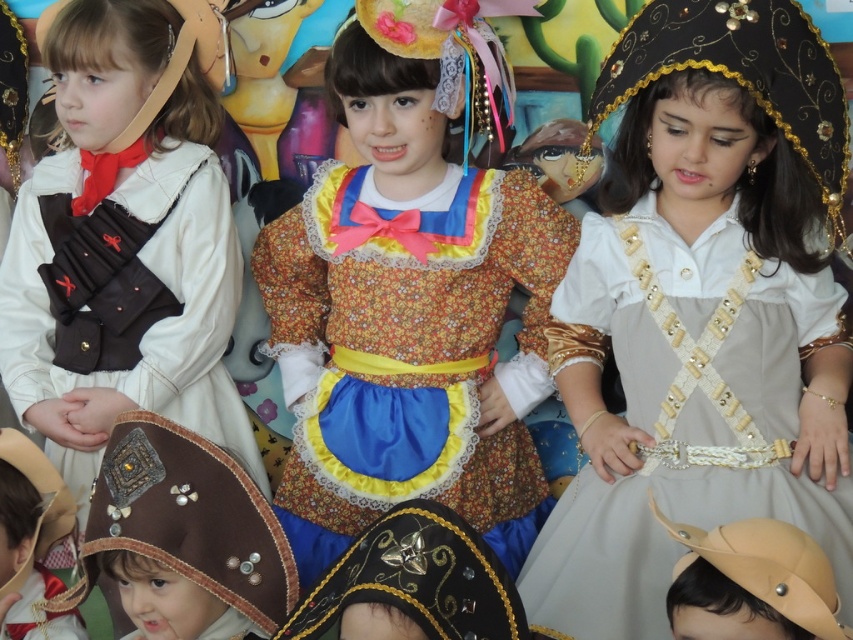
Does black sequined headdress at upper right have a smaller size compared to matte brown hat at lower left?

Incorrect, black sequined headdress at upper right is not smaller in size than matte brown hat at lower left.

Is black sequined headdress at upper right closer to the viewer compared to matte brown hat at lower left?

Yes, black sequined headdress at upper right is closer to the viewer.

Is point (830, 164) in front of point (56, 513)?

Yes, it is in front of point (56, 513).

Identify the location of black sequined headdress at upper right. (743, 76).

Can you confirm if floral fabric dress at center is positioned below black sequined headdress at upper right?

Yes.

Is floral fabric dress at center to the left of black sequined headdress at upper right from the viewer's perspective?

Indeed, floral fabric dress at center is positioned on the left side of black sequined headdress at upper right.

Based on the photo, who is more forward, (296, 564) or (822, 44)?

Point (822, 44) is in front.

The height and width of the screenshot is (640, 853). I want to click on floral fabric dress at center, so tap(410, 298).

Can you confirm if light beige satin dress at center is positioned to the right of black sequined headdress at upper right?

Incorrect, light beige satin dress at center is not on the right side of black sequined headdress at upper right.

Is point (564, 300) less distant than point (699, 3)?

No, it is not.

Identify the location of light beige satin dress at center. The height and width of the screenshot is (640, 853). (682, 413).